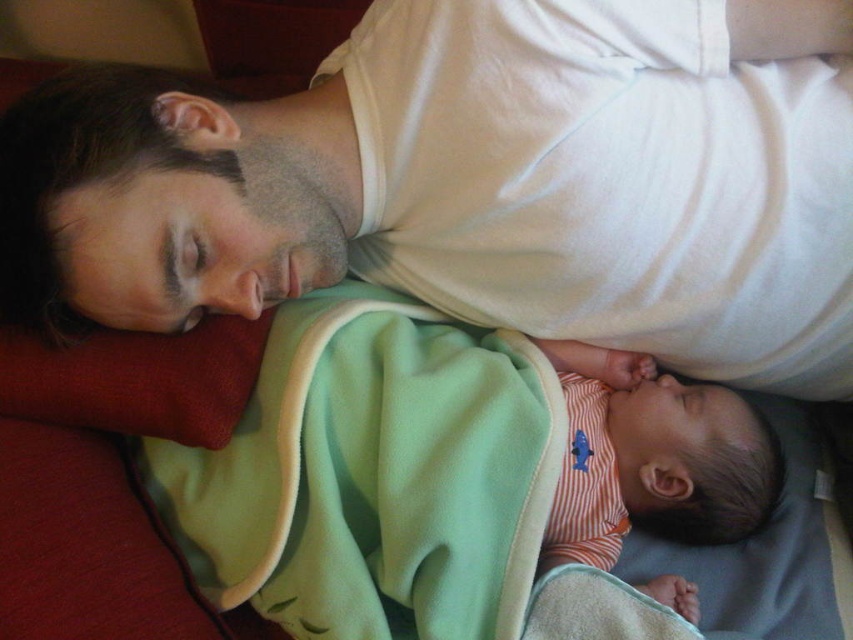
Question: Which of these objects is positioned closest to the orange striped fabric at center?

Choices:
 (A) white cotton shirt at upper center
 (B) orange striped fabric at lower center

Answer: (B)

Question: Is white cotton shirt at upper center thinner than orange striped fabric at center?

Choices:
 (A) no
 (B) yes

Answer: (A)

Question: Among these objects, which one is farthest from the camera?

Choices:
 (A) white cotton shirt at upper center
 (B) orange striped fabric at center
 (C) orange striped fabric at lower center

Answer: (B)

Question: Does white cotton shirt at upper center appear under orange striped fabric at center?

Choices:
 (A) yes
 (B) no

Answer: (B)

Question: Which of the following is the farthest from the observer?

Choices:
 (A) (827, 321)
 (B) (321, 548)
 (C) (590, 461)

Answer: (C)

Question: Can you confirm if orange striped fabric at lower center is bigger than orange striped fabric at center?

Choices:
 (A) yes
 (B) no

Answer: (A)